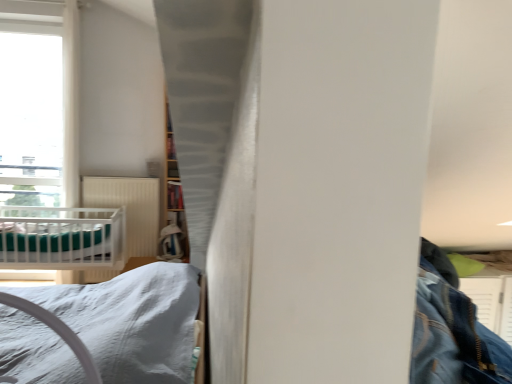
Question: Is wooden bookshelf at center surrounded by white ribbed radiator at center?

Choices:
 (A) no
 (B) yes

Answer: (A)

Question: From the image's perspective, is white ribbed radiator at center on wooden bookshelf at center?

Choices:
 (A) yes
 (B) no

Answer: (B)

Question: From the image's perspective, is white ribbed radiator at center beneath wooden bookshelf at center?

Choices:
 (A) no
 (B) yes

Answer: (B)

Question: From a real-world perspective, does white ribbed radiator at center stand above wooden bookshelf at center?

Choices:
 (A) yes
 (B) no

Answer: (B)

Question: Can you confirm if white ribbed radiator at center is taller than wooden bookshelf at center?

Choices:
 (A) no
 (B) yes

Answer: (B)

Question: Looking at their shapes, would you say white ribbed radiator at center is wider or thinner than white satin bed at lower left?

Choices:
 (A) wide
 (B) thin

Answer: (B)

Question: Based on their positions, is white ribbed radiator at center located to the left or right of white satin bed at lower left?

Choices:
 (A) right
 (B) left

Answer: (B)

Question: Is white ribbed radiator at center bigger or smaller than white satin bed at lower left?

Choices:
 (A) small
 (B) big

Answer: (B)

Question: From the image's perspective, relative to white satin bed at lower left, is white ribbed radiator at center above or below?

Choices:
 (A) above
 (B) below

Answer: (A)

Question: Is teal fabric sheet at left in front of or behind wooden bookshelf at center in the image?

Choices:
 (A) behind
 (B) front

Answer: (B)

Question: From a real-world perspective, is teal fabric sheet at left positioned above or below wooden bookshelf at center?

Choices:
 (A) below
 (B) above

Answer: (A)

Question: Is point (83, 231) positioned closer to the camera than point (179, 205)?

Choices:
 (A) closer
 (B) farther

Answer: (A)

Question: From the image's perspective, relative to wooden bookshelf at center, is teal fabric sheet at left above or below?

Choices:
 (A) below
 (B) above

Answer: (A)

Question: In the image, is wooden bookshelf at center on the left side or the right side of white ribbed radiator at center?

Choices:
 (A) left
 (B) right

Answer: (B)

Question: From the image's perspective, is wooden bookshelf at center above or below white ribbed radiator at center?

Choices:
 (A) above
 (B) below

Answer: (A)